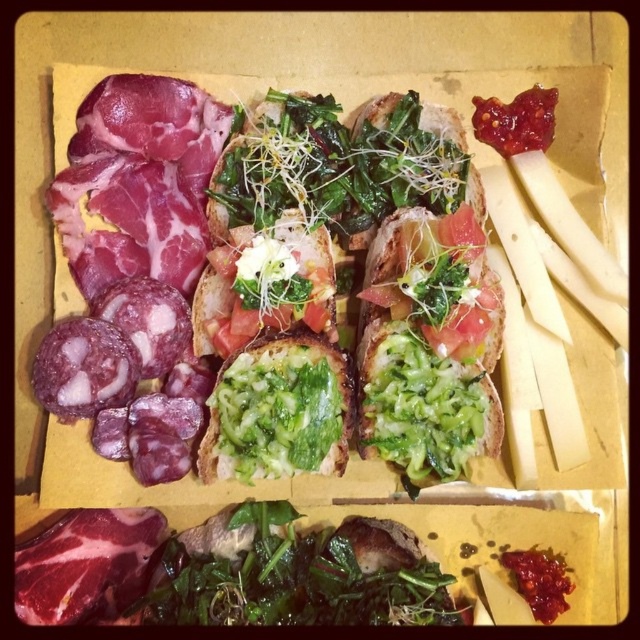
You are a customer at a restaurant and you want to point out the green leafy vegetable at center on the charcuterie board. Where exactly should you look on the board?

The green leafy vegetable at center is located at point 0.637 on the x axis and 0.662 on the y axis.

You are standing 1.5 meters away from a charcuterie board. You want to reach a point on the board at coordinates point (392, 355). Can you safely extend your hand to touch that point without overreaching?

The distance of point (392, 355) from camera is 1.41 meters. Since you are standing 1.5 meters away, you can safely extend your hand to touch that point as it is within reach.